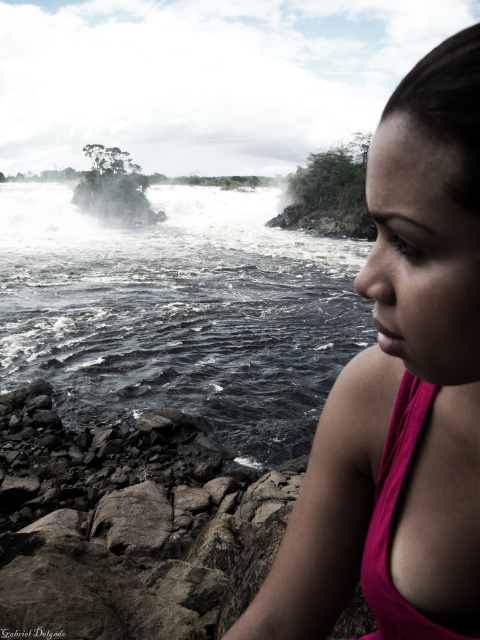
Does point (459, 524) lie in front of point (154, 232)?

Yes, it is in front of point (154, 232).

Measure the distance between point (430,524) and camera.

Point (430,524) and camera are 60.90 centimeters apart.

Find the location of a particular element. This screenshot has width=480, height=640. pink fabric at center is located at coordinates (400, 392).